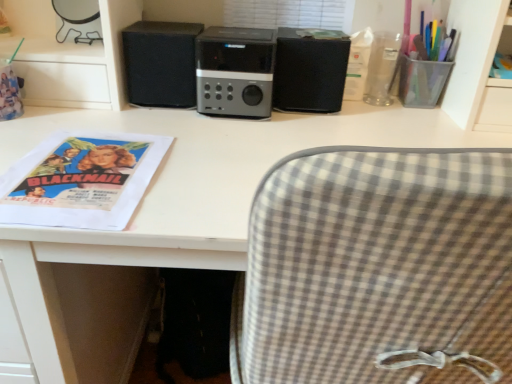
I want to click on free space above black matte speaker at center, acting as the second speaker starting from the right (from a real-world perspective), so click(175, 15).